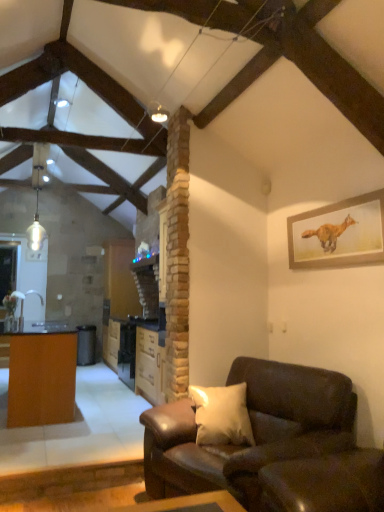
The width and height of the screenshot is (384, 512). What do you see at coordinates (338, 234) in the screenshot?
I see `wooden framed fox painting at upper right` at bounding box center [338, 234].

This screenshot has height=512, width=384. What are the coordinates of `wooden framed fox painting at upper right` in the screenshot? It's located at pyautogui.click(x=338, y=234).

Considering the relative sizes of brown wood cabinet at center and wooden framed fox painting at upper right in the image provided, is brown wood cabinet at center wider than wooden framed fox painting at upper right?

Indeed, brown wood cabinet at center has a greater width compared to wooden framed fox painting at upper right.

Considering the relative sizes of brown wood cabinet at center and wooden framed fox painting at upper right in the image provided, is brown wood cabinet at center taller than wooden framed fox painting at upper right?

Yes.

In the image, is brown wood cabinet at center positioned in front of or behind wooden framed fox painting at upper right?

brown wood cabinet at center is behind wooden framed fox painting at upper right.

Is there a large distance between brown wood cabinet at center and wooden framed fox painting at upper right?

Indeed, brown wood cabinet at center is not near wooden framed fox painting at upper right.

Which of these two, wooden table at left or leather couch at lower right, stands taller?

With more height is leather couch at lower right.

Consider the image. Who is bigger, wooden table at left or leather couch at lower right?

With larger size is wooden table at left.

Could leather couch at lower right be considered to be inside wooden table at left?

No.

From a real-world perspective, who is located lower, wooden table at left or leather couch at lower right?

From a 3D spatial view, leather couch at lower right is below.

Is point (145, 392) in front of point (18, 379)?

That is False.

From the image's perspective, which is above, brown wood cabinet at center or wooden table at left?

brown wood cabinet at center appears higher in the image.

Considering the sizes of brown wood cabinet at center and wooden table at left in the image, is brown wood cabinet at center wider or thinner than wooden table at left?

brown wood cabinet at center is thinner than wooden table at left.

From a real-world perspective, which is physically above, wooden table at left or wooden framed fox painting at upper right?

From a 3D spatial view, wooden framed fox painting at upper right is above.

Is wooden table at left taller or shorter than wooden framed fox painting at upper right?

In the image, wooden table at left appears to be taller than wooden framed fox painting at upper right.

Considering the relative sizes of wooden table at left and wooden framed fox painting at upper right in the image provided, is wooden table at left smaller than wooden framed fox painting at upper right?

No, wooden table at left is not smaller than wooden framed fox painting at upper right.

Who is smaller, wooden framed fox painting at upper right or leather couch at lower right?

With smaller size is wooden framed fox painting at upper right.

Is wooden framed fox painting at upper right positioned with its back to leather couch at lower right?

No.

Where is `picture frame above the leather couch at lower right (from a real-world perspective)`? The width and height of the screenshot is (384, 512). picture frame above the leather couch at lower right (from a real-world perspective) is located at coordinates (338, 234).

Between wooden framed fox painting at upper right and leather couch at lower right, which one has more height?

leather couch at lower right is taller.

Looking at this image, which object is wider, leather couch at lower right or wooden table at left?

leather couch at lower right.

Locate an element on the screen. table on the left side of leather couch at lower right is located at coordinates (42, 375).

From the picture: Which object is more forward, leather couch at lower right or wooden table at left?

leather couch at lower right is more forward.

Measure the distance from leather couch at lower right to wooden table at left.

leather couch at lower right is 1.96 meters away from wooden table at left.

Looking at this image, how much distance is there between wooden framed fox painting at upper right and wooden table at left?

A distance of 2.62 meters exists between wooden framed fox painting at upper right and wooden table at left.

In the scene shown: Is wooden framed fox painting at upper right turned away from wooden table at left?

wooden framed fox painting at upper right is not turned away from wooden table at left.

Between point (341, 236) and point (60, 357), which one is positioned behind?

The point (60, 357) is farther from the camera.

In the image, is wooden framed fox painting at upper right on the left side or the right side of wooden table at left?

wooden framed fox painting at upper right is positioned on wooden table at left's right side.

At what (x,y) coordinates should I click in order to perform the action: click on picture frame that is above the brown wood cabinet at center (from the image's perspective). Please return your answer as a coordinate pair (x, y). Looking at the image, I should click on (338, 234).

Find the location of a particular element. This screenshot has width=384, height=512. studio couch below the wooden table at left (from a real-world perspective) is located at coordinates (252, 430).

Considering their positions, is wooden table at left positioned closer to wooden framed fox painting at upper right than brown wood cabinet at center?

brown wood cabinet at center is positioned closer to the anchor wooden framed fox painting at upper right.

Which object lies nearer to the anchor point leather couch at lower right, wooden framed fox painting at upper right or wooden table at left?

The object closer to leather couch at lower right is wooden framed fox painting at upper right.

From the image, which object appears to be nearer to wooden framed fox painting at upper right, leather couch at lower right or brown wood cabinet at center?

Based on the image, leather couch at lower right appears to be nearer to wooden framed fox painting at upper right.

From the image, which object appears to be farther from wooden table at left, wooden framed fox painting at upper right or brown wood cabinet at center?

Among the two, wooden framed fox painting at upper right is located further to wooden table at left.

Estimate the real-world distances between objects in this image. Which object is closer to wooden framed fox painting at upper right, brown wood cabinet at center or leather couch at lower right?

leather couch at lower right is positioned closer to the anchor wooden framed fox painting at upper right.

When comparing their distances from wooden framed fox painting at upper right, does wooden table at left or leather couch at lower right seem further?

wooden table at left is positioned further to the anchor wooden framed fox painting at upper right.

From the image, which object appears to be farther from leather couch at lower right, wooden table at left or wooden framed fox painting at upper right?

The object further to leather couch at lower right is wooden table at left.

Based on the photo, looking at the image, which one is located further to wooden framed fox painting at upper right, brown wood cabinet at center or wooden table at left?

wooden table at left lies further to wooden framed fox painting at upper right than the other object.

Where is `picture frame positioned between leather couch at lower right and brown wood cabinet at center from near to far`? The image size is (384, 512). picture frame positioned between leather couch at lower right and brown wood cabinet at center from near to far is located at coordinates (338, 234).

Locate an element on the screen. cabinetry located between wooden table at left and wooden framed fox painting at upper right in the left-right direction is located at coordinates (150, 365).

This screenshot has width=384, height=512. I want to click on table between leather couch at lower right and brown wood cabinet at center along the z-axis, so click(x=42, y=375).

Find the location of `studio couch between wooden table at left and wooden framed fox painting at upper right from left to right`. studio couch between wooden table at left and wooden framed fox painting at upper right from left to right is located at coordinates (252, 430).